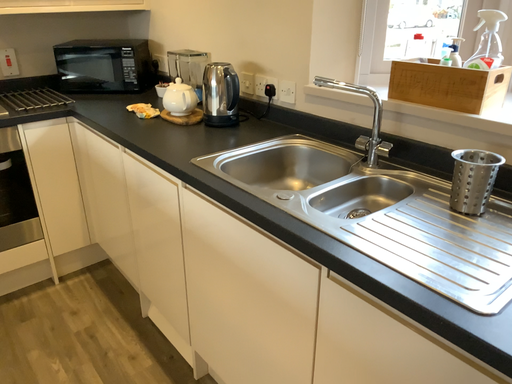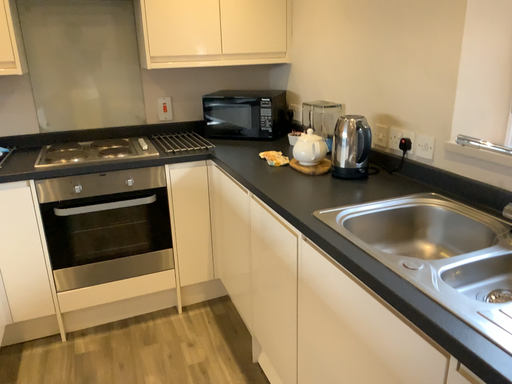
Question: How did the camera likely rotate when shooting the video?

Choices:
 (A) rotated left
 (B) rotated right

Answer: (A)